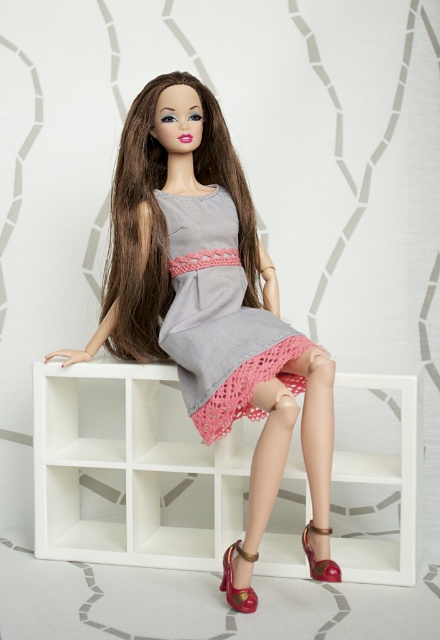
You are a fashion designer who wants to place a decorative accessory between the matte gray dress at center and the shiny gold sandal at lower center. The accessory is 20 inches long. Will it fit in the space between them?

The distance between the matte gray dress at center and the shiny gold sandal at lower center is 25.02 inches. Since the accessory is 20 inches long, it will fit within the available space.

You are trying to decide if the shiny gold sandal at lower center can fit inside the matte gray dress at center. Based on their sizes, is this possible?

The matte gray dress at center is wider than the shiny gold sandal at lower center, so the sandal could potentially fit inside the dress if there is enough space.

You are standing in front of the doll on the shelving unit. There are two points marked on the wall behind the doll. The first point is at coordinates point (x=160, y=282) and the second point is at point (x=242, y=288). If you were to draw a line from your eye level to each point, which point would appear closer to the doll?

Point (x=160, y=282) is behind point (x=242, y=288), so the point (x=242, y=288) would appear closer to the doll since it is in front of the other point.